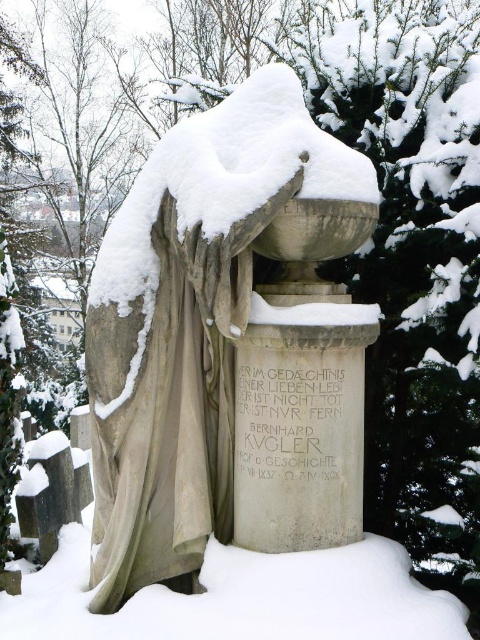
Question: From the image, what is the correct spatial relationship of stone statue at center in relation to white stone inscription at center?

Choices:
 (A) below
 (B) above

Answer: (B)

Question: Which of the following is the farthest from the observer?

Choices:
 (A) (333, 509)
 (B) (340, 422)

Answer: (B)

Question: From the image, what is the correct spatial relationship of stone statue at center in relation to white stone inscription at center?

Choices:
 (A) above
 (B) below

Answer: (A)

Question: Is stone statue at center in front of white stone inscription at center?

Choices:
 (A) yes
 (B) no

Answer: (A)